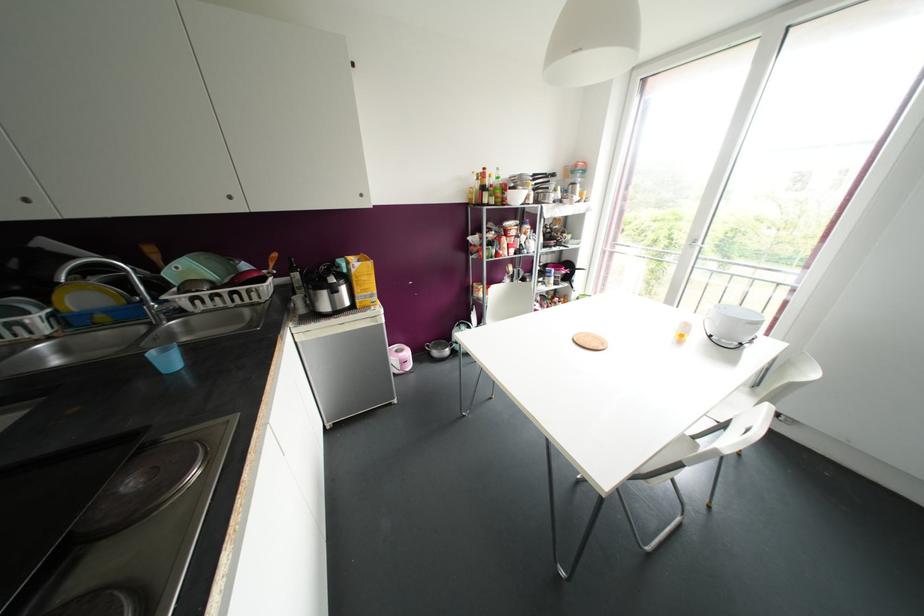
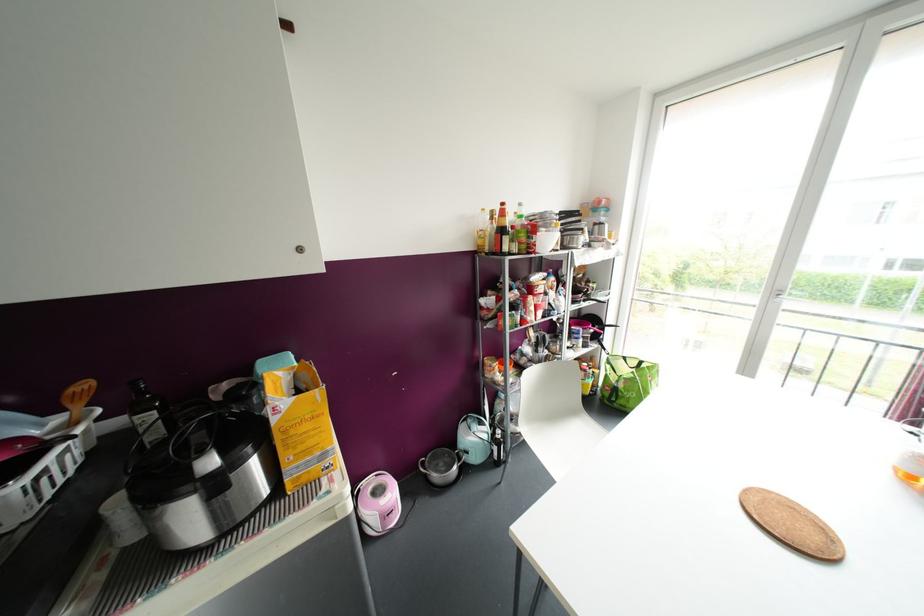
Locate, in the second image, the point that corresponds to point 296,275 in the first image.

(150, 416)